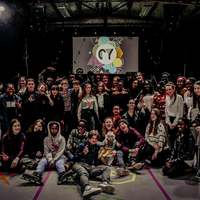
Locate an element on the screen. The width and height of the screenshot is (200, 200). floor is located at coordinates (140, 197).